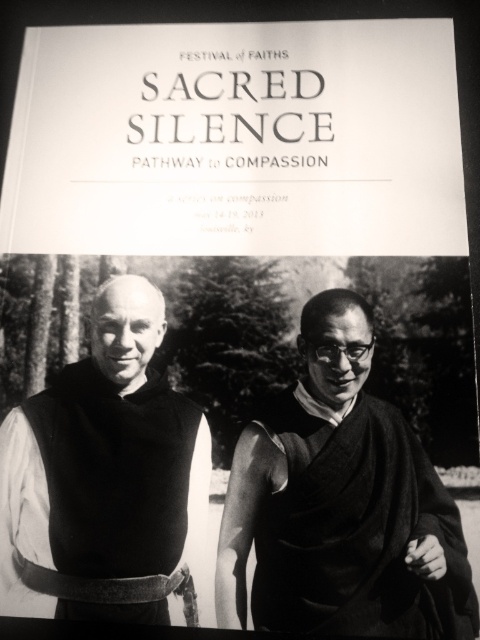
Can you confirm if matte black vest at left is taller than black woolen robe at right?

Correct, matte black vest at left is much taller as black woolen robe at right.

Looking at this image, is matte black vest at left closer to camera compared to black woolen robe at right?

No.

The image size is (480, 640). I want to click on matte black vest at left, so click(106, 477).

Does white paper at upper center have a larger size compared to black woolen robe at right?

Indeed, white paper at upper center has a larger size compared to black woolen robe at right.

Can you confirm if white paper at upper center is positioned above black woolen robe at right?

Yes, white paper at upper center is above black woolen robe at right.

Does point (282, 90) lie behind point (292, 596)?

That is True.

This screenshot has height=640, width=480. What are the coordinates of `white paper at upper center` in the screenshot? It's located at (237, 140).

Is point (432, 22) closer to viewer compared to point (28, 403)?

That is False.

Between white paper at upper center and matte black vest at left, which one has more height?

With more height is matte black vest at left.

Describe the element at coordinates (237, 140) in the screenshot. I see `white paper at upper center` at that location.

Where is `white paper at upper center`? Image resolution: width=480 pixels, height=640 pixels. white paper at upper center is located at coordinates pyautogui.click(x=237, y=140).